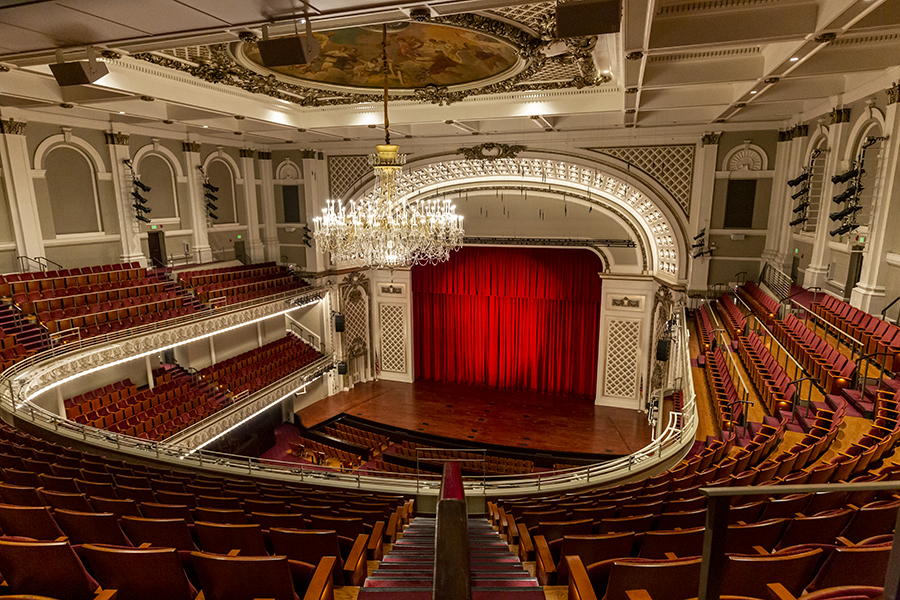
At what (x,y) coordinates should I click in order to perform the action: click on column. Please return your answer as a coordinate pair (x, y). Looking at the image, I should click on (707, 172).